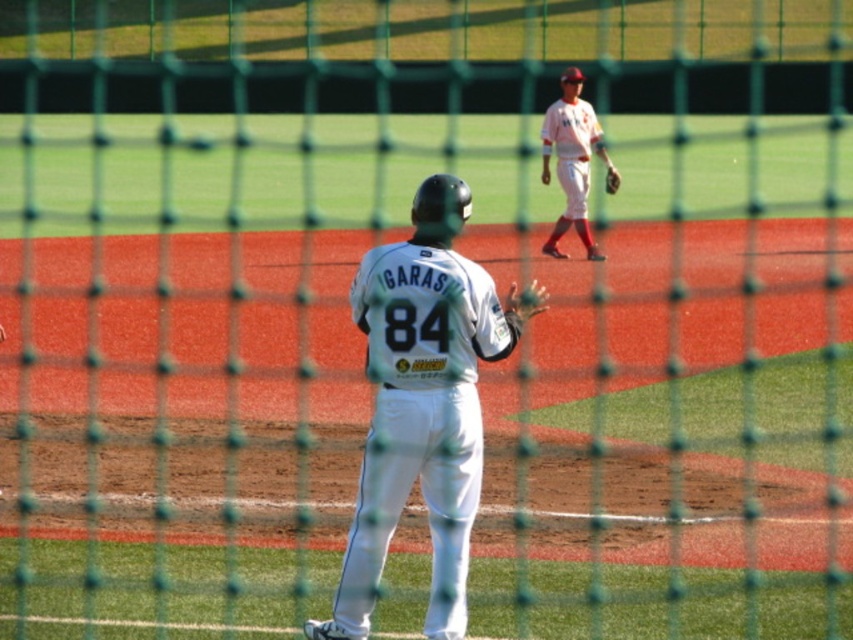
Question: Can you confirm if white matte uniform at center is positioned to the left of brown leather glove at center?

Choices:
 (A) yes
 (B) no

Answer: (A)

Question: Which of the following is the closest to the observer?

Choices:
 (A) brown leather glove at center
 (B) white matte uniform at center
 (C) white uniform at upper center

Answer: (B)

Question: Which point is farther from the camera taking this photo?

Choices:
 (A) (613, 189)
 (B) (577, 154)

Answer: (B)

Question: Is white matte uniform at center to the left of brown leather glove at center from the viewer's perspective?

Choices:
 (A) yes
 (B) no

Answer: (A)

Question: Based on their relative distances, which object is nearer to the white matte uniform at center?

Choices:
 (A) white uniform at upper center
 (B) brown leather glove at center

Answer: (B)

Question: Does white matte uniform at center have a lesser width compared to brown leather glove at center?

Choices:
 (A) no
 (B) yes

Answer: (A)